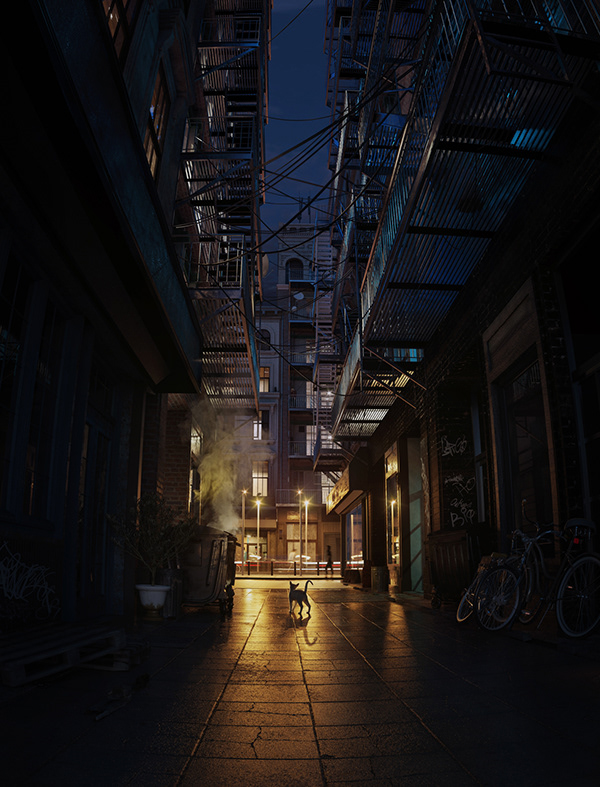
You are a GUI agent. You are given a task and a screenshot of the screen. Output one action in this format:
    pyautogui.click(x=<x>, y=<y>)
    Task: Click on the plant
    This screenshot has width=600, height=787.
    Given the screenshot: What is the action you would take?
    pyautogui.click(x=150, y=530)